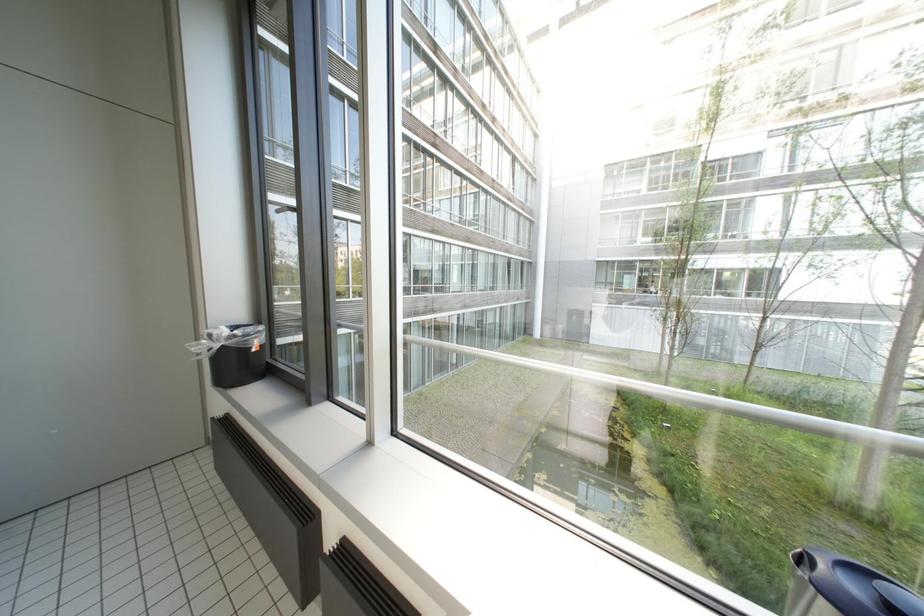
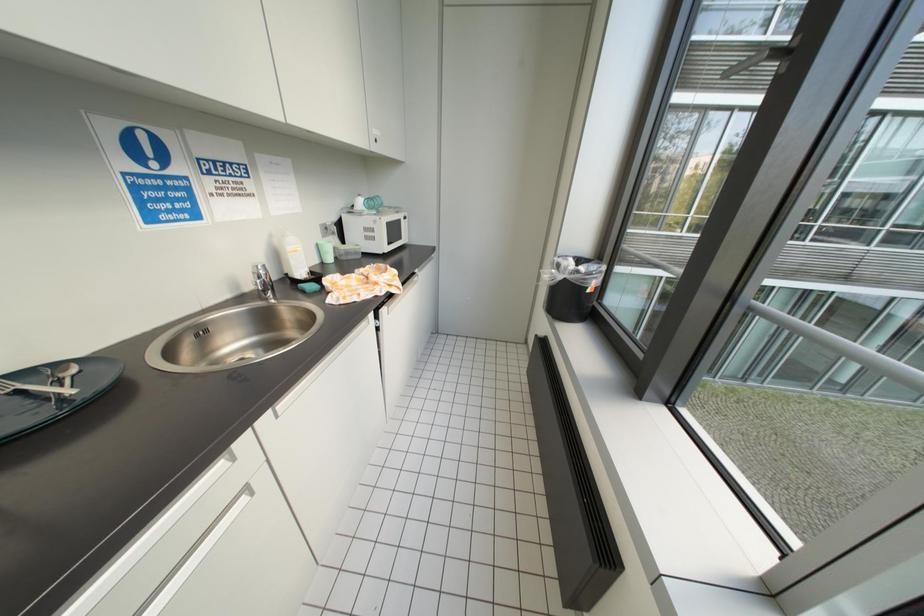
The images are taken continuously from a first-person perspective. In which direction is your viewpoint rotating?

The rotation direction of the camera is left-down.